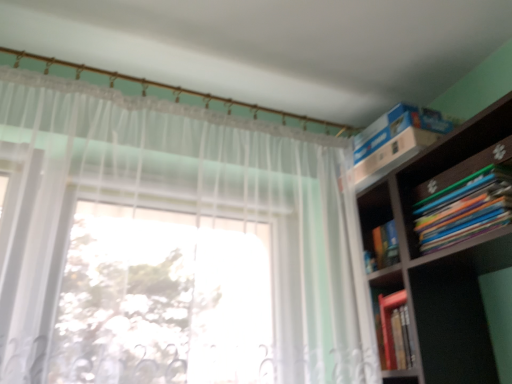
Question: Can you confirm if multicolored paperbacks at upper right is taller than white sheer curtain at upper left?

Choices:
 (A) no
 (B) yes

Answer: (A)

Question: Does multicolored paperbacks at upper right lie in front of white sheer curtain at upper left?

Choices:
 (A) yes
 (B) no

Answer: (B)

Question: Is multicolored paperbacks at upper right next to white sheer curtain at upper left?

Choices:
 (A) no
 (B) yes

Answer: (A)

Question: Is multicolored paperbacks at upper right further to camera compared to white sheer curtain at upper left?

Choices:
 (A) no
 (B) yes

Answer: (B)

Question: Is multicolored paperbacks at upper right at the left side of white sheer curtain at upper left?

Choices:
 (A) no
 (B) yes

Answer: (A)

Question: From the image's perspective, does multicolored paperbacks at upper right appear lower than white sheer curtain at upper left?

Choices:
 (A) no
 (B) yes

Answer: (A)

Question: From the image's perspective, would you say white sheer curtain at upper left is shown under multicolored paperbacks at upper right?

Choices:
 (A) no
 (B) yes

Answer: (B)

Question: Is the position of white sheer curtain at upper left less distant than that of multicolored paperbacks at upper right?

Choices:
 (A) no
 (B) yes

Answer: (B)

Question: Is white sheer curtain at upper left positioned with its back to multicolored paperbacks at upper right?

Choices:
 (A) yes
 (B) no

Answer: (B)

Question: Considering the relative sizes of white sheer curtain at upper left and multicolored paperbacks at upper right in the image provided, is white sheer curtain at upper left wider than multicolored paperbacks at upper right?

Choices:
 (A) no
 (B) yes

Answer: (A)

Question: Is white sheer curtain at upper left shorter than multicolored paperbacks at upper right?

Choices:
 (A) no
 (B) yes

Answer: (A)

Question: Can you confirm if white sheer curtain at upper left is bigger than multicolored paperbacks at upper right?

Choices:
 (A) no
 (B) yes

Answer: (B)

Question: Is point (166, 148) positioned closer to the camera than point (503, 192)?

Choices:
 (A) farther
 (B) closer

Answer: (A)